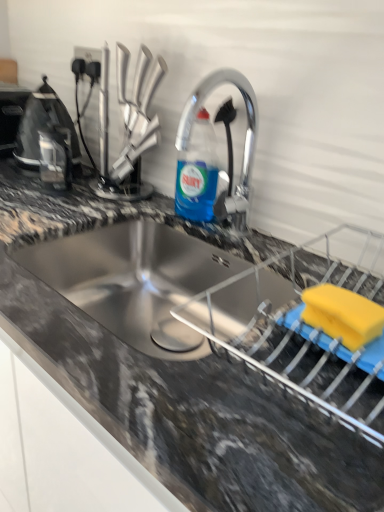
Locate an element on the screen. The width and height of the screenshot is (384, 512). free spot to the left of blue translucent liquid at center is located at coordinates (123, 201).